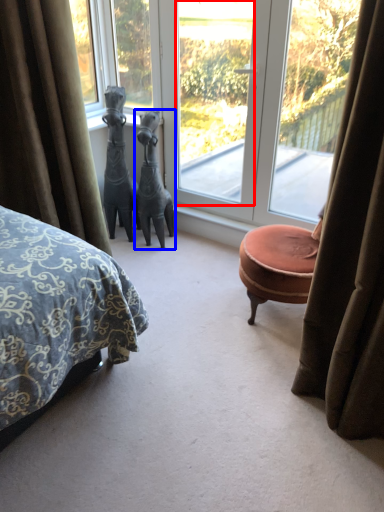
Question: Which of the following is the farthest to the observer, window screen (highlighted by a red box) or animal (highlighted by a blue box)?

Choices:
 (A) window screen
 (B) animal

Answer: (B)